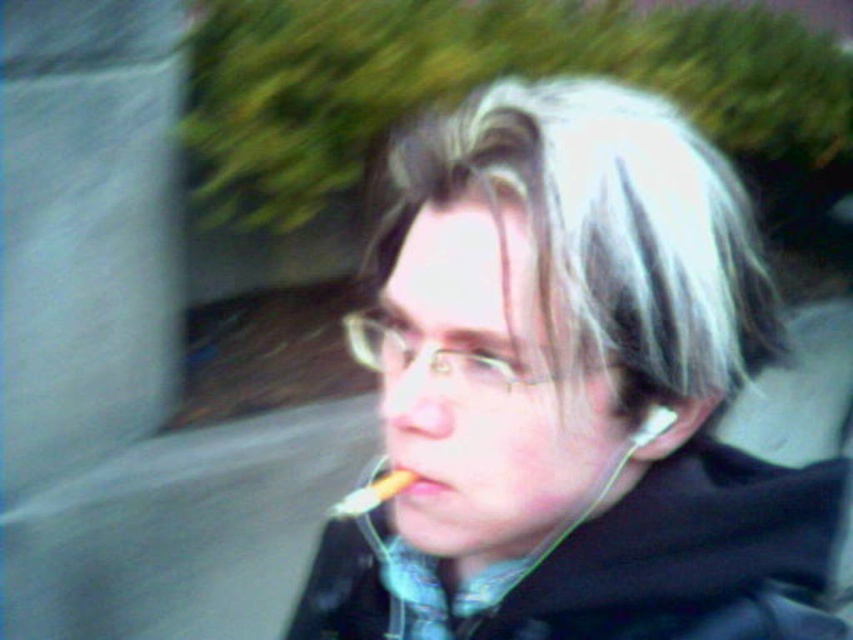
Question: Which object is closer to the camera taking this photo?

Choices:
 (A) black matte jacket at lower right
 (B) yellowish matte cigarette at center

Answer: (A)

Question: Which object is farther from the camera taking this photo?

Choices:
 (A) black matte jacket at lower right
 (B) yellowish matte cigarette at center
 (C) smooth yellow toothbrush at lower center
 (D) matte black jacket at center

Answer: (B)

Question: Which point is farther from the camera taking this photo?

Choices:
 (A) (711, 193)
 (B) (399, 488)

Answer: (B)

Question: Does yellowish matte cigarette at center appear on the right side of smooth yellow toothbrush at lower center?

Choices:
 (A) no
 (B) yes

Answer: (A)

Question: Is matte black jacket at center above yellowish matte cigarette at center?

Choices:
 (A) no
 (B) yes

Answer: (B)

Question: Can you confirm if black matte jacket at lower right is thinner than yellowish matte cigarette at center?

Choices:
 (A) no
 (B) yes

Answer: (A)